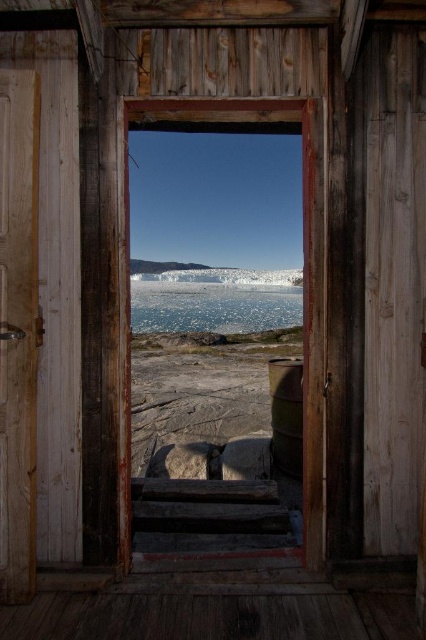
Question: Which of the following is the farthest from the observer?

Choices:
 (A) (161, 314)
 (B) (307, 253)

Answer: (A)

Question: Is wooden door at left to the left of rusty wooden stairs at center from the viewer's perspective?

Choices:
 (A) yes
 (B) no

Answer: (A)

Question: Considering the real-world distances, which object is farthest from the wooden door at left?

Choices:
 (A) rusty wooden stairs at center
 (B) translucent ice at center

Answer: (B)

Question: Which object appears farthest from the camera in this image?

Choices:
 (A) rusty wooden stairs at center
 (B) transparent glass window at center
 (C) wooden door at left
 (D) translucent ice at center

Answer: (D)

Question: Is rusty wooden stairs at center positioned behind translucent ice at center?

Choices:
 (A) no
 (B) yes

Answer: (A)

Question: Can you confirm if rusty wooden stairs at center is positioned to the left of translucent ice at center?

Choices:
 (A) yes
 (B) no

Answer: (B)